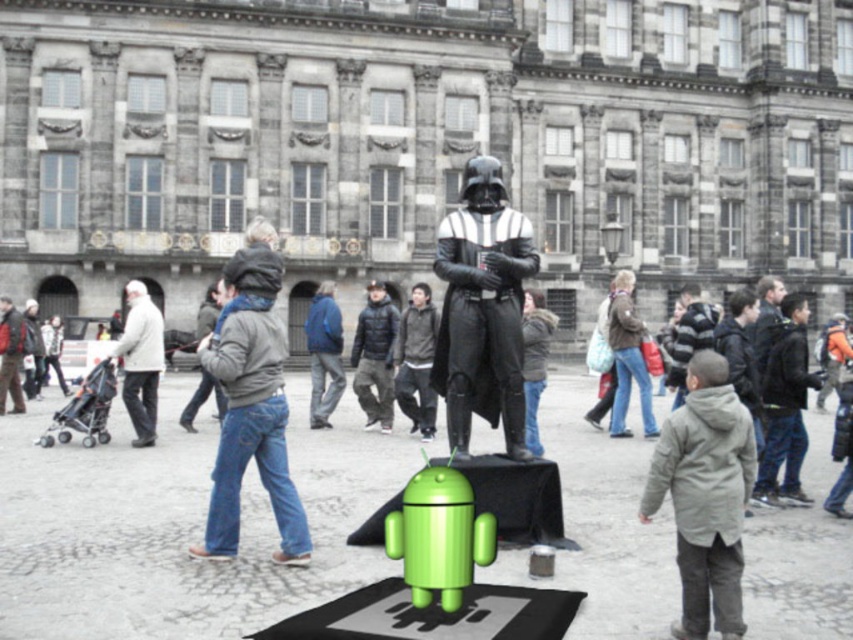
Question: Which point is farther to the camera?

Choices:
 (A) (520, 241)
 (B) (260, 353)
 (C) (131, 412)

Answer: (C)

Question: Considering the real-world distances, which object is farthest from the denim jacket at center?

Choices:
 (A) white woolen coat at left
 (B) dark gray jacket at center
 (C) black leather suit at center

Answer: (B)

Question: Is black leather suit at center to the right of denim jacket at center from the viewer's perspective?

Choices:
 (A) yes
 (B) no

Answer: (A)

Question: Does denim jacket at center lie behind dark gray jacket at center?

Choices:
 (A) yes
 (B) no

Answer: (B)

Question: Which point appears farthest from the camera in this image?

Choices:
 (A) (434, 264)
 (B) (13, 403)
 (C) (279, 472)

Answer: (A)

Question: Is white woolen coat at left positioned at the back of dark gray jacket at center?

Choices:
 (A) no
 (B) yes

Answer: (A)